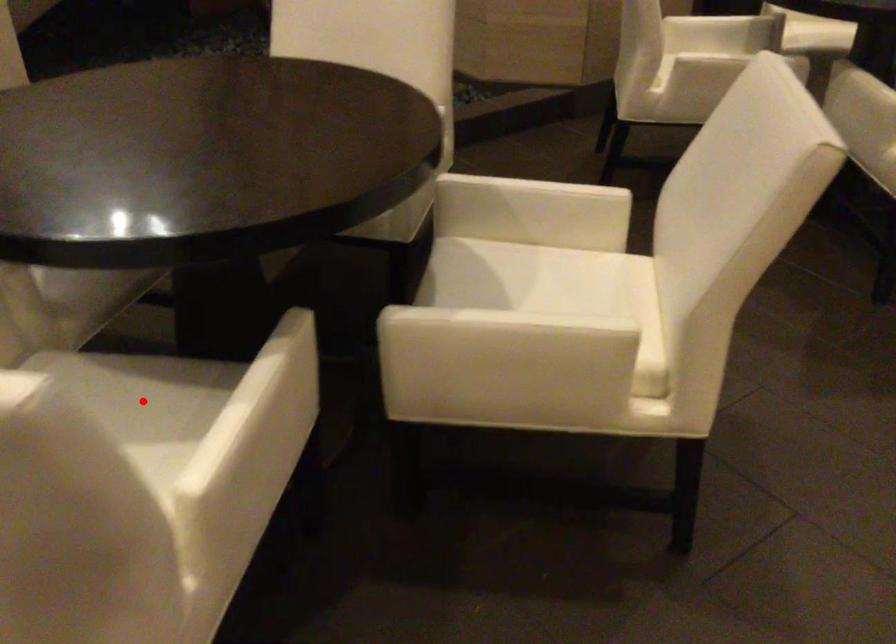
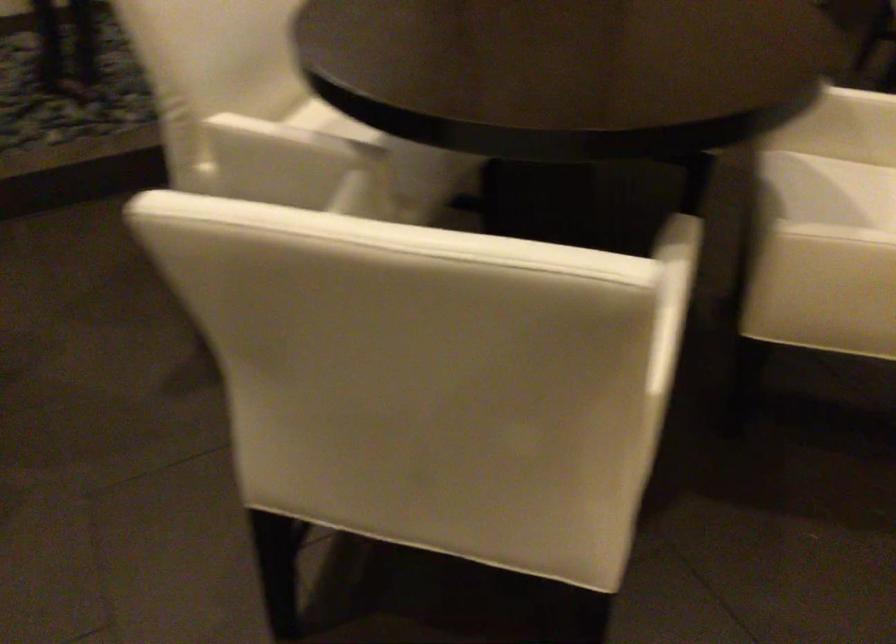
Question: I am providing you with two images of the same scene from different viewpoints. A red point is marked on the first image. At the location where the point appears in image 1, is it still visible in image 2?

Choices:
 (A) Yes
 (B) No

Answer: (B)